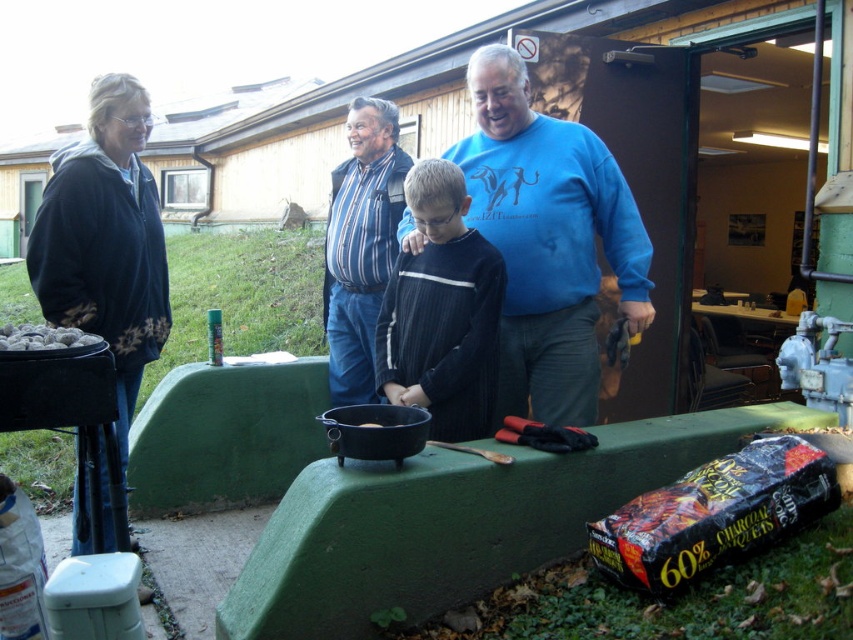
You are standing in the backyard and want to hand a tool to the adult wearing the striped fabric shirt at center without moving closer. The black matte pot at center is in your way. Can you reach them without moving the pot?

The striped fabric shirt at center is further to the viewer than the black matte pot at center, so the pot is closer to you. You can reach the adult wearing the striped fabric shirt at center by going around the pot or moving it out of the way.

You are organizing a clothing donation drive and need to sort items by size. You have two items here, the blue cotton sweater at center and the striped fabric shirt at center. Which one should you place in the large size bin?

The blue cotton sweater at center should be placed in the large size bin since it has a larger size compared to the striped fabric shirt at center.